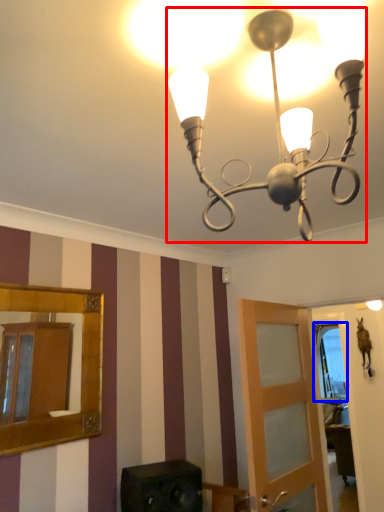
Question: Which object appears closest to the camera in this image, lamp (highlighted by a red box) or window (highlighted by a blue box)?

Choices:
 (A) lamp
 (B) window

Answer: (A)